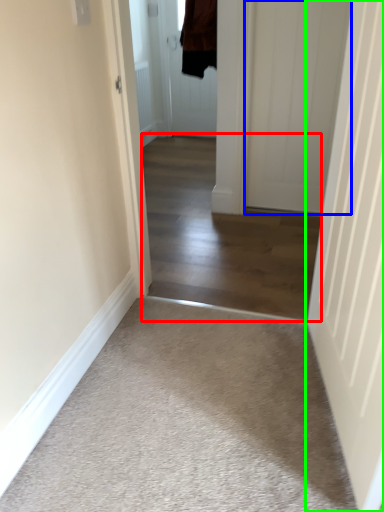
Question: Which object is the farthest from corridor (highlighted by a red box)? Choose among these: door (highlighted by a blue box) or door (highlighted by a green box).

Choices:
 (A) door
 (B) door

Answer: (B)